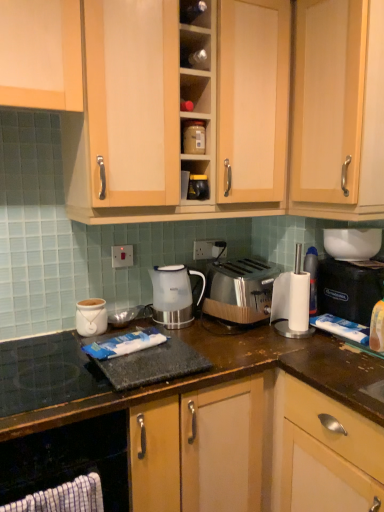
Locate an element on the screen. free space in front of white ceramic jar at center, the 1th appliance when ordered from bottom to top is located at coordinates (55, 352).